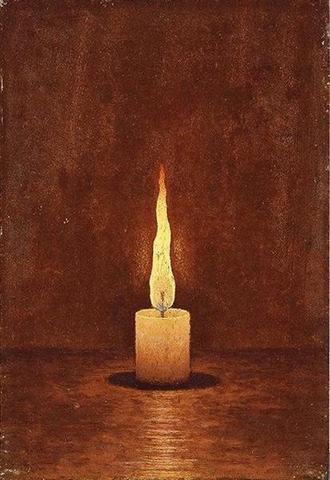
Where is `candle flame`? The width and height of the screenshot is (330, 480). candle flame is located at coordinates (160, 275), (164, 227).